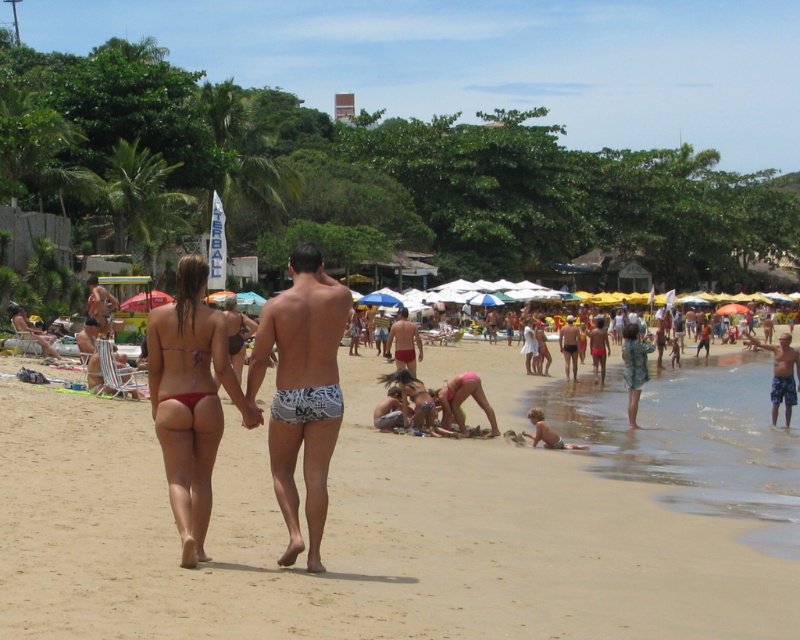
How distant is white printed swim trunks at center from blue plaid shorts at lower right?

white printed swim trunks at center is 13.83 meters from blue plaid shorts at lower right.

Which is above, white printed swim trunks at center or blue plaid shorts at lower right?

Positioned higher is blue plaid shorts at lower right.

Describe the element at coordinates (302, 392) in the screenshot. I see `white printed swim trunks at center` at that location.

Find the location of a particular element. The width and height of the screenshot is (800, 640). white printed swim trunks at center is located at coordinates (302, 392).

Is point (38, 602) less distant than point (644, 360)?

Yes.

Measure the distance between matte bikini at center and floral print dress at lower right.

The distance of matte bikini at center from floral print dress at lower right is 26.58 feet.

Measure the distance between point (x=501, y=566) and camera.

Point (x=501, y=566) is 8.39 meters away from camera.

Where is `matte bikini at center`? This screenshot has width=800, height=640. matte bikini at center is located at coordinates (358, 538).

Does white printed swim trunks at center have a greater width compared to pink fabric bikini at lower center?

Incorrect, white printed swim trunks at center's width does not surpass pink fabric bikini at lower center's.

Between point (320, 435) and point (470, 392), which one is positioned behind?

The point (470, 392) is more distant.

Is point (276, 429) farther from camera compared to point (450, 424)?

No, it is not.

The image size is (800, 640). I want to click on white printed swim trunks at center, so click(x=302, y=392).